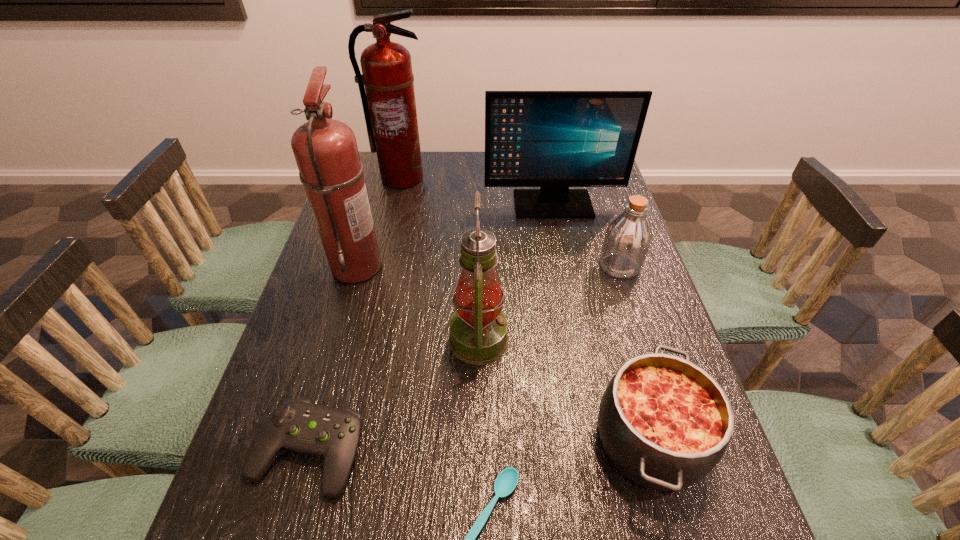
Where is `the farthest object`? The width and height of the screenshot is (960, 540). the farthest object is located at coordinates (389, 106).

Where is `the nearer fire extinguisher`? This screenshot has height=540, width=960. the nearer fire extinguisher is located at coordinates (325, 150).

At what (x,y) coordinates should I click in order to perform the action: click on the fourth nearest object. Please return your answer as a coordinate pair (x, y). The height and width of the screenshot is (540, 960). Looking at the image, I should click on (478, 329).

You are a GUI agent. You are given a task and a screenshot of the screen. Output one action in this format:
    pyautogui.click(x=<x>, y=<y>)
    Task: Click on the monitor
    Image resolution: width=960 pixels, height=540 pixels.
    Given the screenshot: What is the action you would take?
    pyautogui.click(x=554, y=140)

Find the location of a particular element. This screenshot has width=960, height=540. the fourth shortest object is located at coordinates (628, 237).

Locate an element on the screen. the third shortest object is located at coordinates (665, 423).

Identify the location of the second shortest object. The width and height of the screenshot is (960, 540). (297, 424).

The image size is (960, 540). In order to click on vacant region located on the nozzle side of the farther fire extinguisher in this screenshot , I will do `click(383, 259)`.

Where is `free space located 0.190m on the front-facing side of the nearer fire extinguisher`? free space located 0.190m on the front-facing side of the nearer fire extinguisher is located at coordinates (452, 266).

In order to click on vacant space situated on the left of the oil lamp in this screenshot , I will do `click(324, 340)`.